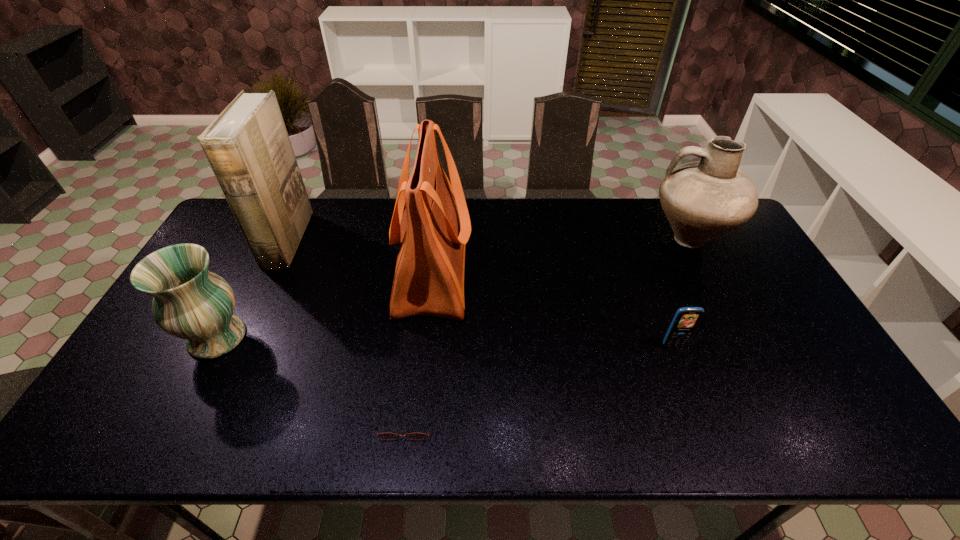
Locate an element on the screen. Image resolution: width=960 pixels, height=540 pixels. vacant space located on the front pocket of the shopping bag is located at coordinates (523, 270).

Locate an element on the screen. free point located on the handle side of the rightmost object is located at coordinates (534, 239).

At what (x,y) coordinates should I click in order to perform the action: click on vacant space located 0.140m on the handle side of the rightmost object. Please return your answer as a coordinate pair (x, y). Image resolution: width=960 pixels, height=540 pixels. Looking at the image, I should click on (605, 239).

Locate an element on the screen. free space located 0.060m on the handle side of the rightmost object is located at coordinates (629, 239).

The image size is (960, 540). Find the location of `free space located on the back of the third shortest object`. free space located on the back of the third shortest object is located at coordinates (271, 236).

The width and height of the screenshot is (960, 540). What are the coordinates of `vacant space positioned 0.050m on the screen of the second shortest object` in the screenshot? It's located at (681, 365).

The image size is (960, 540). Find the location of `phonebook that is at the far edge`. phonebook that is at the far edge is located at coordinates (247, 146).

Identify the location of shopping bag that is at the far edge. The image size is (960, 540). (433, 231).

The height and width of the screenshot is (540, 960). What are the coordinates of `pitcher positioned at the far edge` in the screenshot? It's located at (702, 200).

At what (x,y) coordinates should I click in order to perform the action: click on object present at the near edge. Please return your answer as a coordinate pair (x, y). The image size is (960, 540). Looking at the image, I should click on (385, 436).